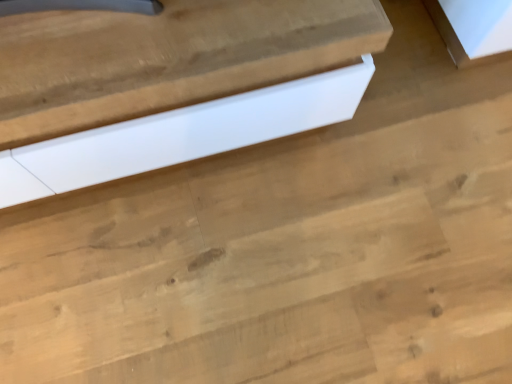
The width and height of the screenshot is (512, 384). Describe the element at coordinates (181, 135) in the screenshot. I see `white glossy plank at upper center` at that location.

Where is `white glossy plank at upper center`? white glossy plank at upper center is located at coordinates (181, 135).

The height and width of the screenshot is (384, 512). I want to click on white glossy plank at upper center, so click(x=181, y=135).